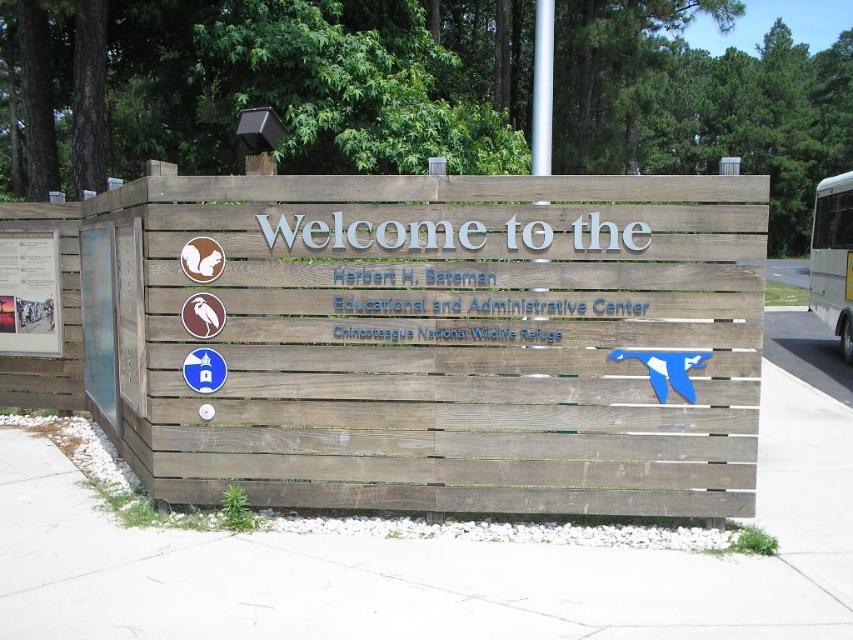
You are standing in front of the Herbert H. Bateman Educational and Administrative Center. You notice a wooden sign at left and a white glossy bus at right. Which object is wider?

The white glossy bus at right is wider than the wooden sign at left.

You are a visitor at Chincoteague National Wildlife Refuge and want to know which object is bigger between the wooden sign at left and the white glossy bus at right. Based on the scene description, can you determine which one is larger?

The wooden sign at left is smaller than the white glossy bus at right, so the white glossy bus at right is larger.

You are standing in front of the signboard at the Herbert H. Bateman Educational and Administrative Center. You notice two points marked on the signboard. The first point is at coordinates point (x=51, y=282) and the second is at point (x=96, y=308). From your perspective, which point appears closer to you?

Point (x=96, y=308) appears closer to you because the description states that point (x=51, y=282) is behind point (x=96, y=308).